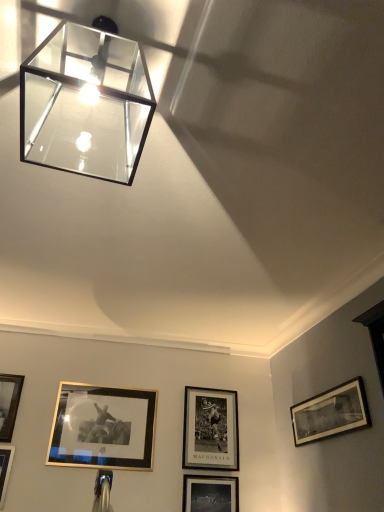
Question: Considering the positions of point (23, 89) and point (326, 403), is point (23, 89) closer or farther from the camera than point (326, 403)?

Choices:
 (A) farther
 (B) closer

Answer: (B)

Question: From the image's perspective, is clear glass cube at upper left located above or below black matte picture frame at lower right, which is the 1th picture frame from right to left?

Choices:
 (A) below
 (B) above

Answer: (B)

Question: Which of these objects is positioned farthest from the gold-framed picture at lower left, which is the 5th picture frame from right to left?

Choices:
 (A) black matte picture frame at lower right, the 5th picture frame in the left-to-right sequence
 (B) black matte picture frame at center, placed as the second picture frame when sorted from right to left
 (C) clear glass cube at upper left
 (D) matte black picture frame at lower center, the third picture frame viewed from the right
 (E) gold metallic picture frame at lower left, placed as the 4th picture frame when sorted from right to left

Answer: (C)

Question: Estimate the real-world distances between objects in this image. Which object is farther from the gold metallic picture frame at lower left, the 2th picture frame in the left-to-right sequence?

Choices:
 (A) clear glass cube at upper left
 (B) black matte picture frame at lower right, which is the 1th picture frame from right to left
 (C) black matte picture frame at center, placed as the second picture frame when sorted from right to left
 (D) gold-framed picture at lower left, which is the 5th picture frame from right to left
 (E) matte black picture frame at lower center, the third picture frame viewed from the right

Answer: (A)